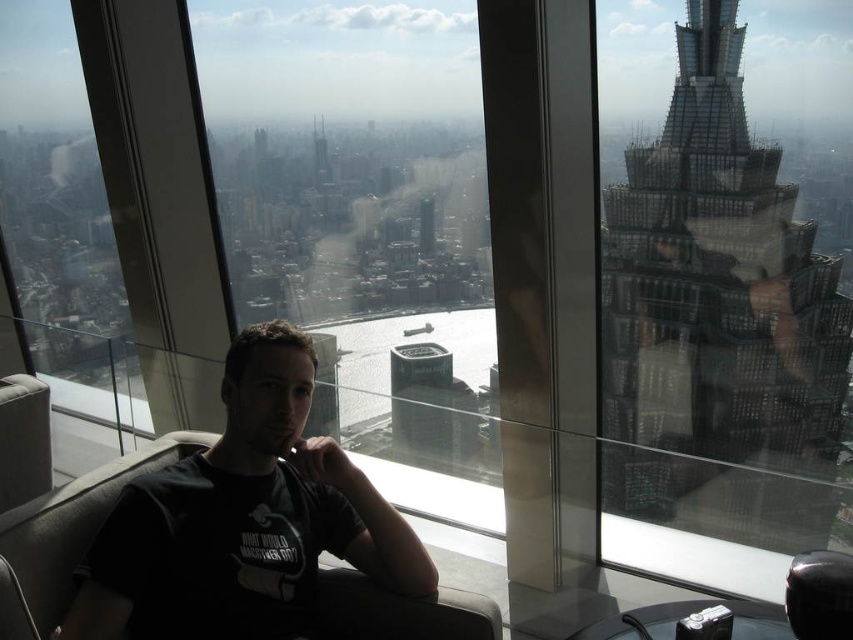
Question: Which point is closer to the camera?

Choices:
 (A) (230, 147)
 (B) (769, 544)
 (C) (180, 612)

Answer: (C)

Question: Which object is farther from the camera taking this photo?

Choices:
 (A) black matte shirt at center
 (B) transparent glass window at right
 (C) transparent glass window at center

Answer: (C)

Question: Which point is closer to the camera taking this photo?

Choices:
 (A) (212, 570)
 (B) (801, 440)

Answer: (A)

Question: Can you confirm if transparent glass window at center is positioned to the right of black matte shirt at center?

Choices:
 (A) no
 (B) yes

Answer: (B)

Question: Is transparent glass window at right thinner than black matte shirt at center?

Choices:
 (A) no
 (B) yes

Answer: (B)

Question: Does transparent glass window at right appear under transparent glass window at center?

Choices:
 (A) no
 (B) yes

Answer: (B)